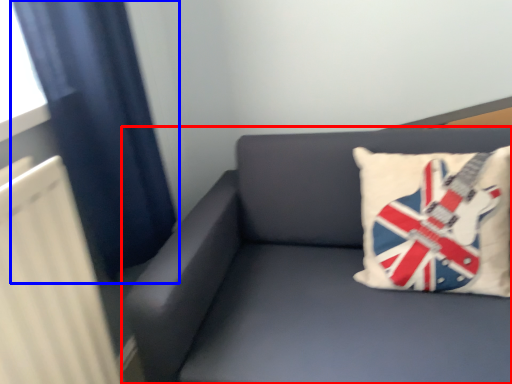
Question: Which of the following is the closest to the observer, studio couch (highlighted by a red box) or curtain (highlighted by a blue box)?

Choices:
 (A) studio couch
 (B) curtain

Answer: (A)